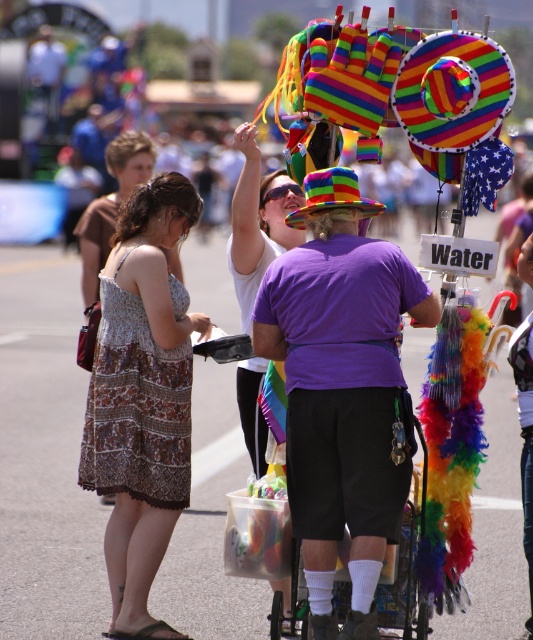
Question: Does purple cotton shirt at center appear on the left side of multicolored feathered cart at center?

Choices:
 (A) yes
 (B) no

Answer: (A)

Question: Can you confirm if printed fabric dress at center is positioned to the left of multicolored feathered cart at center?

Choices:
 (A) no
 (B) yes

Answer: (B)

Question: Which of the following is the closest to the observer?

Choices:
 (A) (91, 449)
 (B) (254, 394)
 (C) (372, 348)

Answer: (C)

Question: Is printed fabric dress at center positioned at the back of multicolored feathered cart at center?

Choices:
 (A) no
 (B) yes

Answer: (B)

Question: Which of the following is the farthest from the observer?

Choices:
 (A) (136, 454)
 (B) (286, 612)
 (C) (383, 588)

Answer: (A)

Question: Which of the following is the closest to the observer?

Choices:
 (A) (87, 436)
 (B) (288, 195)

Answer: (A)